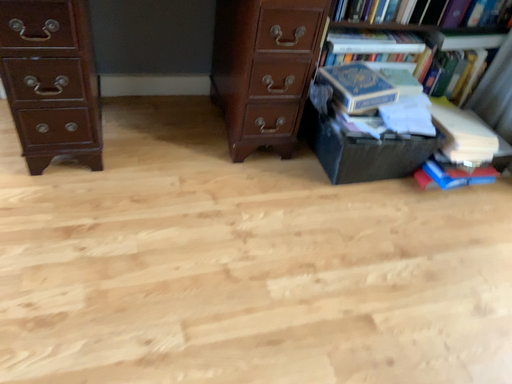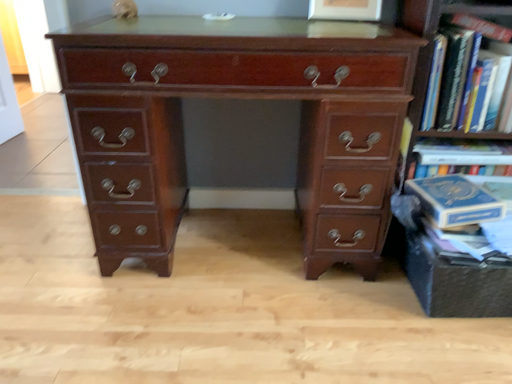
Question: How did the camera likely rotate when shooting the video?

Choices:
 (A) rotated upward
 (B) rotated downward

Answer: (A)